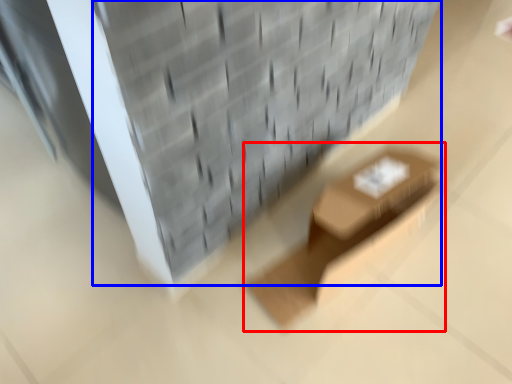
Question: Which object is closer to the camera taking this photo, furniture (highlighted by a red box) or brickwork (highlighted by a blue box)?

Choices:
 (A) furniture
 (B) brickwork

Answer: (B)